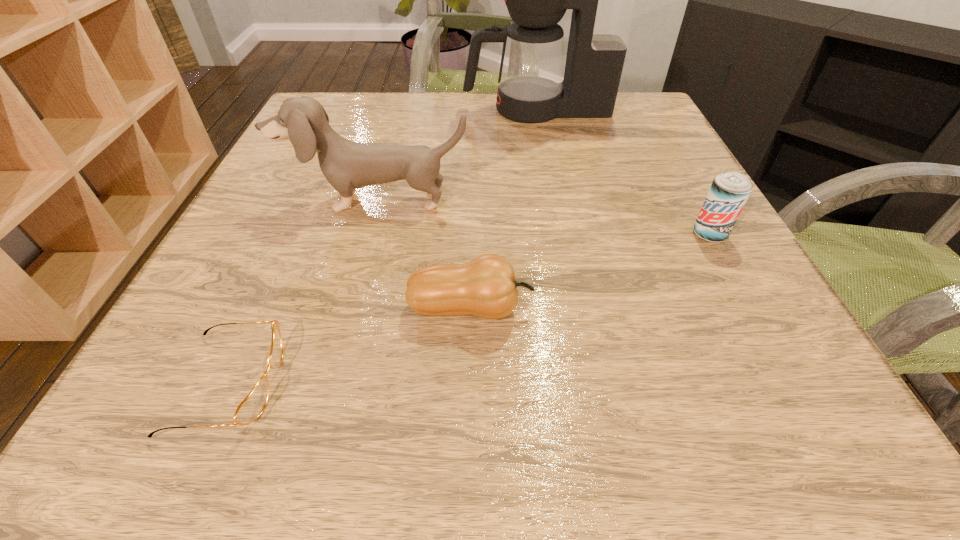
I want to click on spectacles that is at the left edge, so click(252, 406).

Identify the location of coffee maker that is at the right edge. The image size is (960, 540). [x=531, y=89].

Identify the location of beer can at the right edge. (729, 192).

At what (x,y) coordinates should I click in order to perform the action: click on object present at the near left corner. Please return your answer as a coordinate pair (x, y). This screenshot has height=540, width=960. Looking at the image, I should click on (252, 406).

Find the location of `object positioned at the far right corner`. object positioned at the far right corner is located at coordinates (531, 89).

In order to click on free region at the far edge of the desktop in this screenshot , I will do `click(480, 133)`.

Locate an element on the screen. The height and width of the screenshot is (540, 960). free region at the left edge of the desktop is located at coordinates (288, 258).

In the image, there is a desktop. Where is `vacant space at the right edge`? The width and height of the screenshot is (960, 540). vacant space at the right edge is located at coordinates (739, 332).

Find the location of `vacant space at the near left corner of the desktop`. vacant space at the near left corner of the desktop is located at coordinates (217, 420).

In the image, there is a desktop. Where is `vacant space at the near right corner`? The width and height of the screenshot is (960, 540). vacant space at the near right corner is located at coordinates (760, 420).